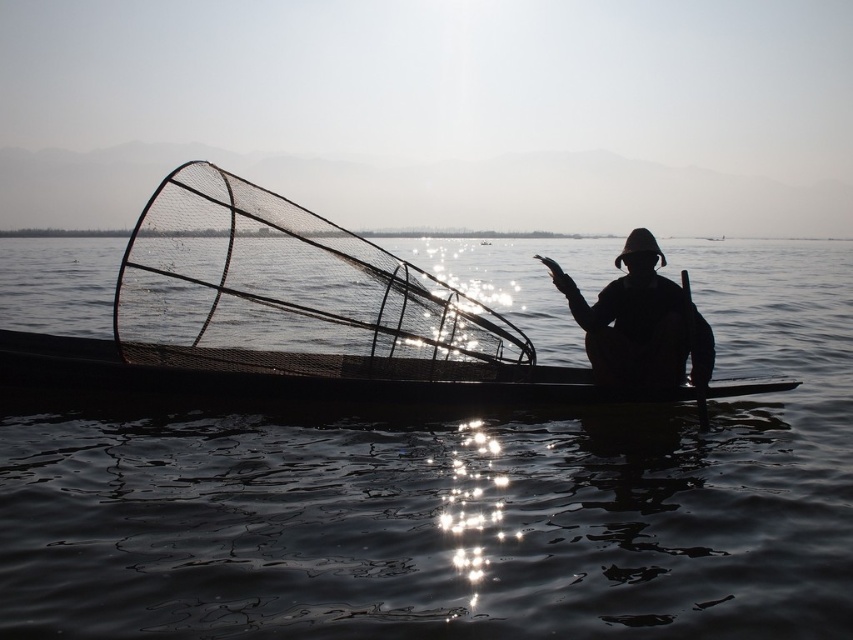
Question: Does transparent water at center appear on the right side of silhouette hat at center?

Choices:
 (A) no
 (B) yes

Answer: (A)

Question: Is transparent water at center bigger than smooth wood canoe at center?

Choices:
 (A) yes
 (B) no

Answer: (A)

Question: Which point is closer to the camera?

Choices:
 (A) silhouette hat at center
 (B) smooth wood canoe at center
 (C) black wood paddle at right
 (D) transparent water at center

Answer: (D)

Question: Which of these objects is positioned closest to the transparent water at center?

Choices:
 (A) silhouette hat at center
 (B) smooth wood canoe at center
 (C) black wood paddle at right

Answer: (A)

Question: Does smooth wood canoe at center appear on the left side of silhouette hat at center?

Choices:
 (A) yes
 (B) no

Answer: (A)

Question: Among these points, which one is nearest to the camera?

Choices:
 (A) (778, 552)
 (B) (152, 358)
 (C) (642, 264)

Answer: (A)